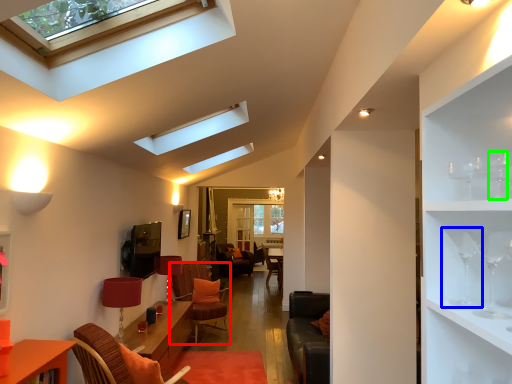
Question: Considering the real-world distances, which object is closest to swivel chair (highlighted by a red box)? wine glass (highlighted by a blue box) or wine glass (highlighted by a green box).

Choices:
 (A) wine glass
 (B) wine glass

Answer: (A)